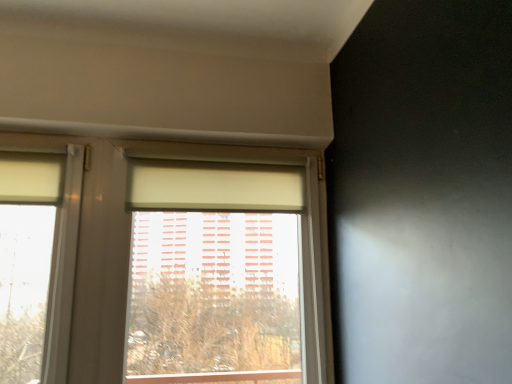
Question: From a real-world perspective, is matte white window at center positioned above or below beige fabric curtain at center?

Choices:
 (A) above
 (B) below

Answer: (B)

Question: Is point (87, 329) positioned closer to the camera than point (151, 193)?

Choices:
 (A) closer
 (B) farther

Answer: (A)

Question: Considering the positions of matte white window at center and beige fabric curtain at center in the image, is matte white window at center wider or thinner than beige fabric curtain at center?

Choices:
 (A) thin
 (B) wide

Answer: (B)

Question: From the image's perspective, is beige fabric curtain at center above or below matte white window at center?

Choices:
 (A) above
 (B) below

Answer: (A)

Question: Is beige fabric curtain at center to the left or to the right of matte white window at center in the image?

Choices:
 (A) right
 (B) left

Answer: (B)

Question: From a real-world perspective, is beige fabric curtain at center physically located above or below matte white window at center?

Choices:
 (A) below
 (B) above

Answer: (B)

Question: Which is correct: beige fabric curtain at center is inside matte white window at center, or outside of it?

Choices:
 (A) outside
 (B) inside

Answer: (B)